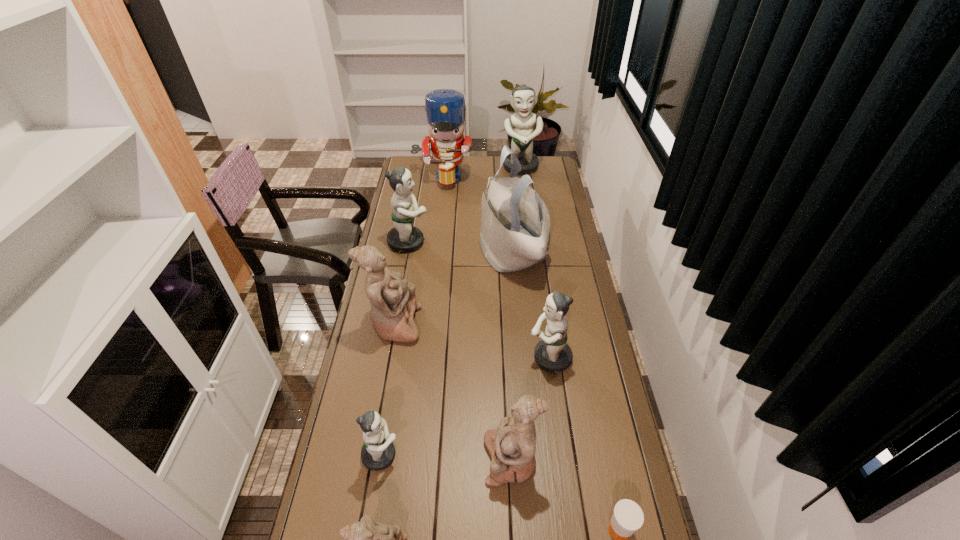
Locate an element on the screen. The height and width of the screenshot is (540, 960). the smallest green figurine is located at coordinates (378, 452).

Find the location of a particular element. This screenshot has width=960, height=540. vacant area situated 0.170m on the front-facing side of the biggest green figurine is located at coordinates (524, 197).

I want to click on vacant space located on the front-facing side of the nutcracker, so click(x=438, y=225).

Where is `vacant space situated on the left of the shopping bag`? The width and height of the screenshot is (960, 540). vacant space situated on the left of the shopping bag is located at coordinates (439, 251).

Find the location of `free space located 0.090m on the front-facing side of the biggest white figurine`. free space located 0.090m on the front-facing side of the biggest white figurine is located at coordinates (445, 325).

This screenshot has width=960, height=540. What are the coordinates of `free region located on the front-facing side of the third smallest green figurine` in the screenshot? It's located at pyautogui.click(x=486, y=242).

In order to click on vacant space situated 0.150m on the front-facing side of the third farthest green figurine in this screenshot , I will do `click(485, 358)`.

Where is `free region located on the front-facing side of the third farthest green figurine`? This screenshot has height=540, width=960. free region located on the front-facing side of the third farthest green figurine is located at coordinates (505, 358).

I want to click on vacant space located 0.070m on the front-facing side of the third farthest green figurine, so click(x=508, y=358).

Find the location of a particular element. vacant space positioned 0.390m on the front-facing side of the second nearest white figurine is located at coordinates (348, 459).